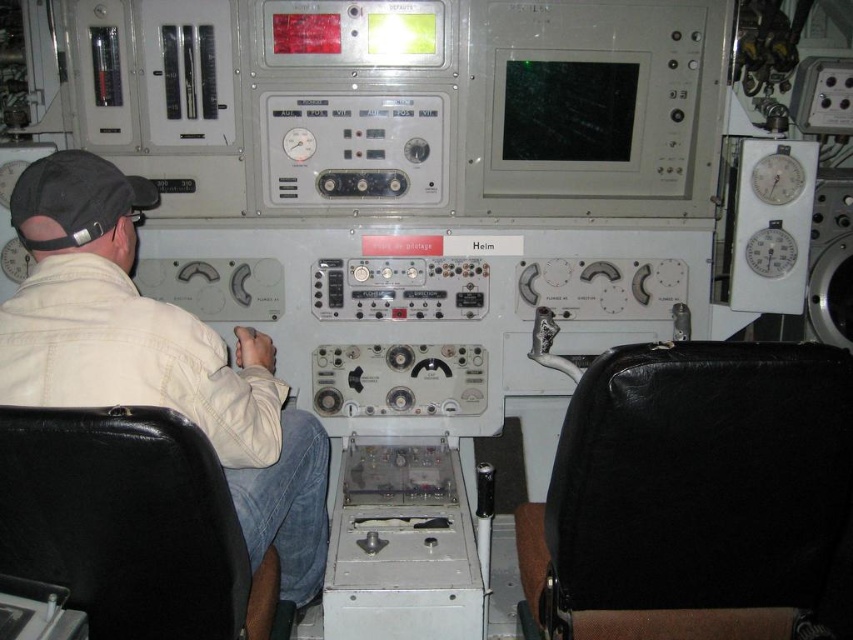
Question: Can you confirm if white leather jacket at left is positioned below black leather chair at lower left?

Choices:
 (A) yes
 (B) no

Answer: (B)

Question: Which object is closer to the camera taking this photo?

Choices:
 (A) black fabric baseball cap at left
 (B) white leather jacket at left
 (C) black leather chair at lower left
 (D) black leather chair at right

Answer: (C)

Question: Among these points, which one is nearest to the camera?

Choices:
 (A) (692, 420)
 (B) (47, 497)
 (C) (59, 180)

Answer: (B)

Question: Does black leather chair at right have a greater width compared to white leather jacket at left?

Choices:
 (A) yes
 (B) no

Answer: (A)

Question: Which of the following is the farthest from the observer?

Choices:
 (A) black leather chair at right
 (B) black leather chair at lower left
 (C) white leather jacket at left

Answer: (C)

Question: Does white leather jacket at left appear on the left side of black fabric baseball cap at left?

Choices:
 (A) no
 (B) yes

Answer: (A)